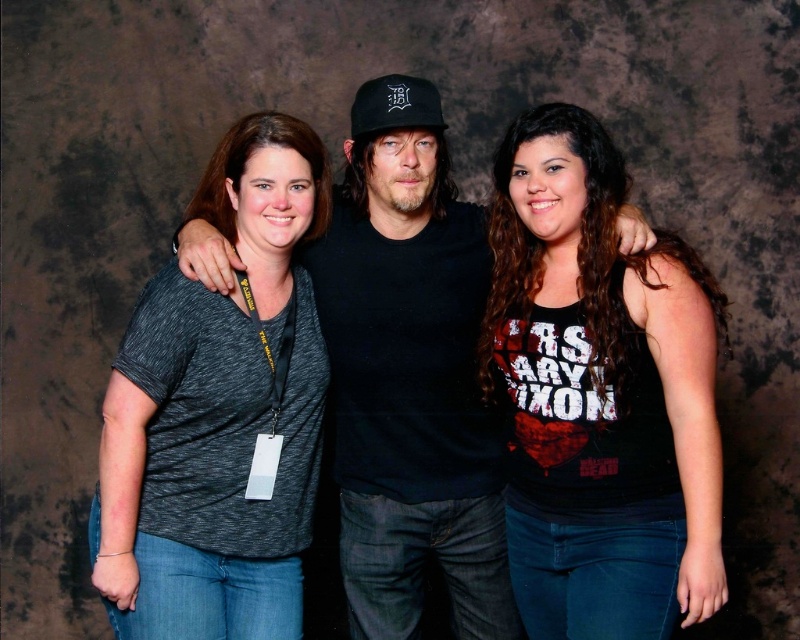
You are trying to decide which item to grab first from the center of the image to hand to someone. The black tank top at center and the black matte baseball cap at center are both there. Which one has a greater width?

The black tank top at center has a greater width than the black matte baseball cap at center.

What is the color of the clothing worn by the person located at the coordinates point (600, 394) in the image?

The point (600, 394) marks the black tank top at center, so the color is black.